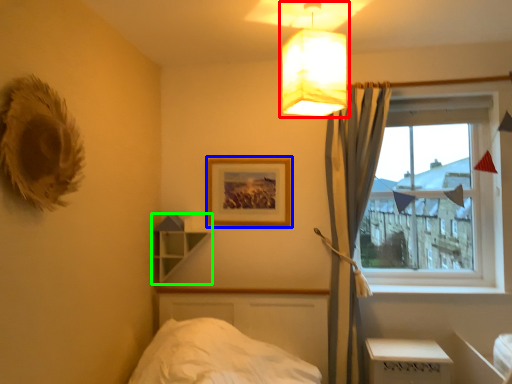
Question: Which object is positioned farthest from lamp (highlighted by a red box)? Select from picture frame (highlighted by a blue box) and shelf (highlighted by a green box).

Choices:
 (A) picture frame
 (B) shelf

Answer: (B)